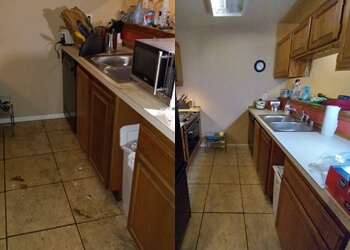
Find the location of a particular element. This screenshot has width=350, height=250. trash can is located at coordinates (126, 155).